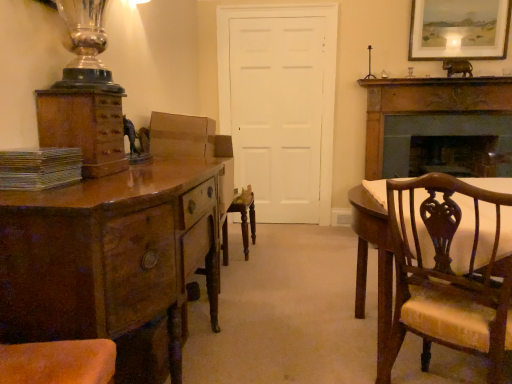
From a real-world perspective, what is the 2D location of a free space above matte white picture frame at upper right? Please provide its 2D coordinates.

[(0.875, -0.000)]